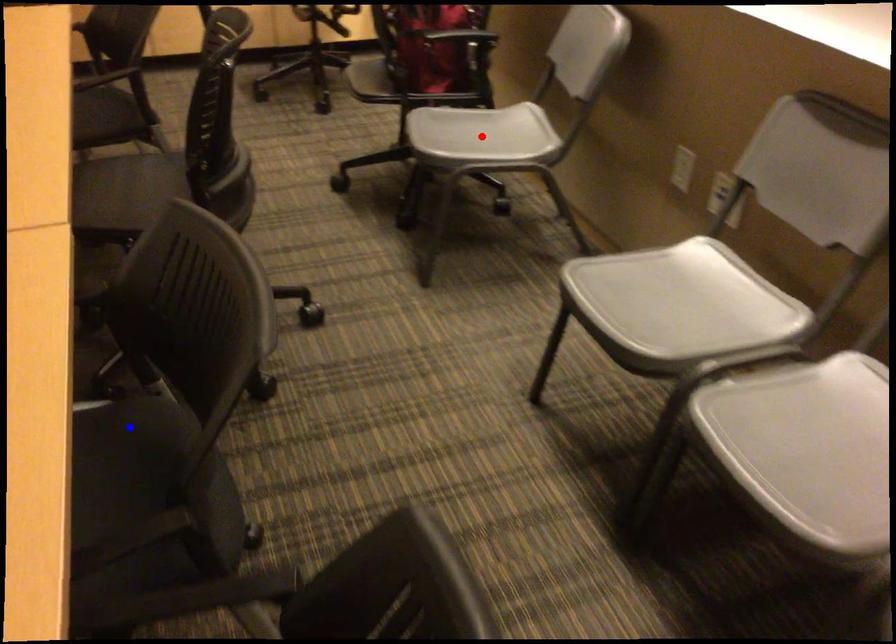
Question: Which of the two points in the image is closer to the camera?

Choices:
 (A) Blue point is closer.
 (B) Red point is closer.

Answer: (A)